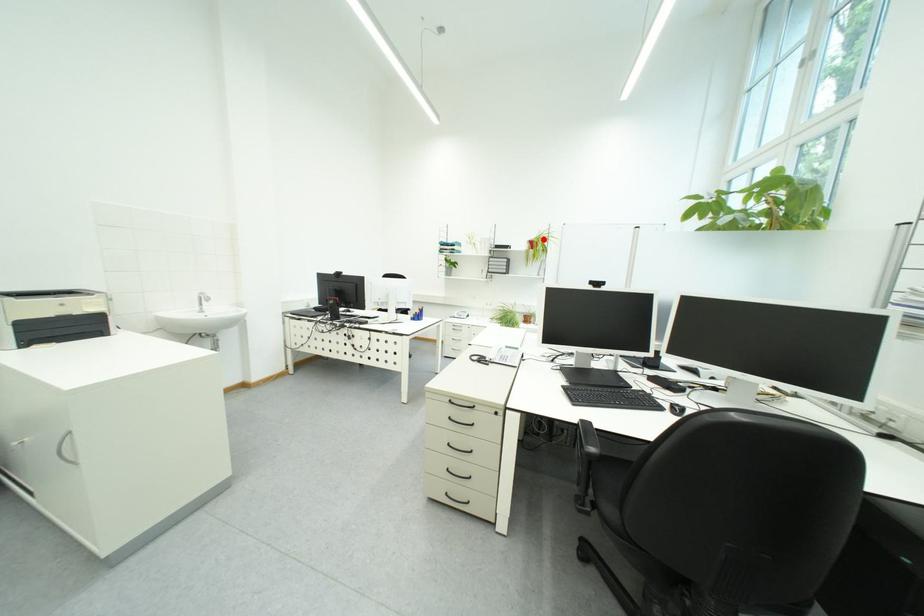
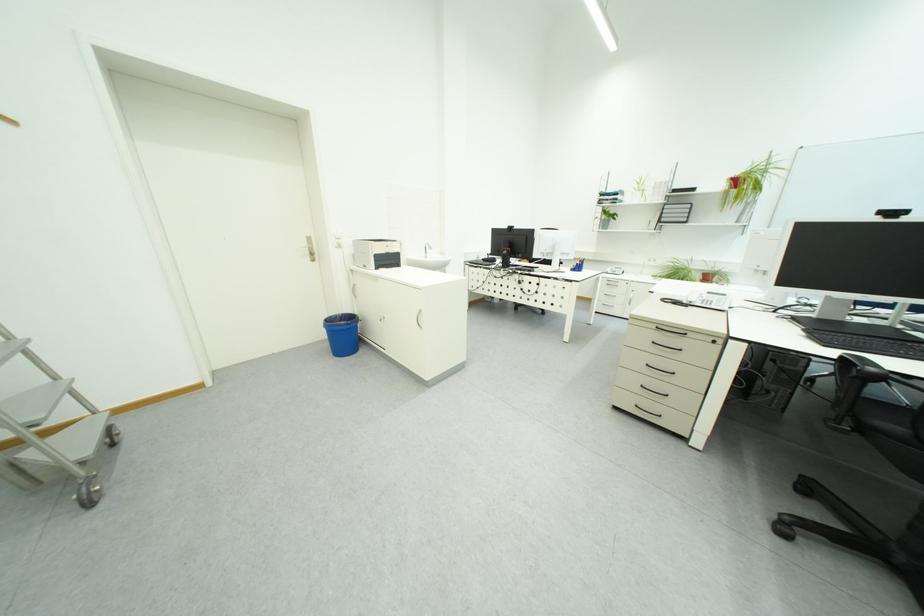
Question: I am providing you with two images of the same scene from different viewpoints. Image1 has a red point marked. In image2, the corresponding 3D location appears at what relative position? Reply with the corresponding letter.

Choices:
 (A) Closer
 (B) Farther

Answer: (B)